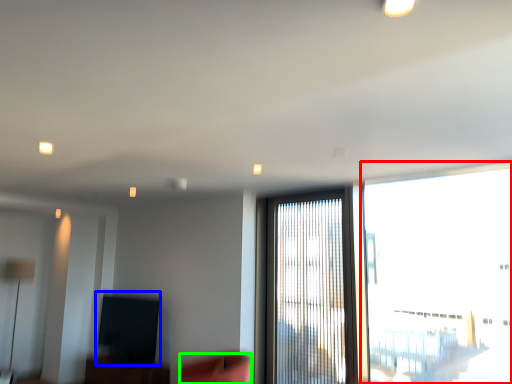
Question: Based on their relative distances, which object is nearer to window (highlighted by a red box)? Choose from window screen (highlighted by a blue box) and swivel chair (highlighted by a green box).

Choices:
 (A) window screen
 (B) swivel chair

Answer: (B)